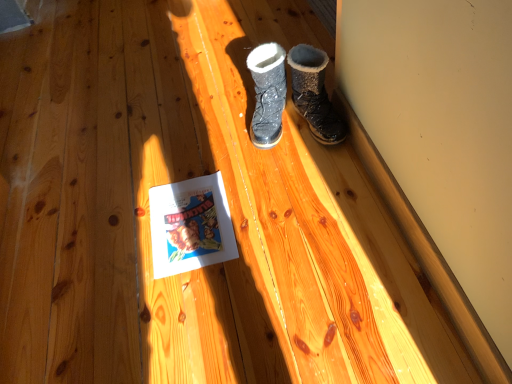
Image resolution: width=512 pixels, height=384 pixels. I want to click on free area in between dark brown suede boot at upper right, which appears as the first footwear when viewed from the right, and sparkly black boot at center, the first footwear from the left, so click(291, 137).